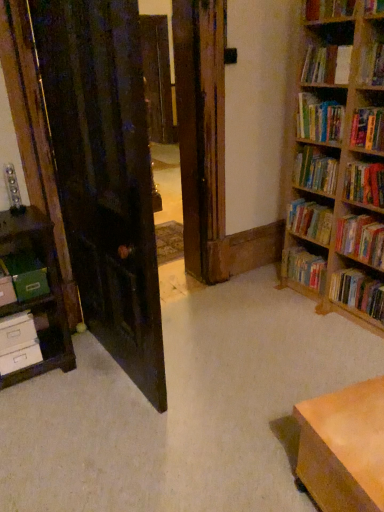
The width and height of the screenshot is (384, 512). What are the coordinates of `vacant area situated below hardcover book at right, the seventh book positioned from the top (from a real-world perspective)` in the screenshot? It's located at (366, 275).